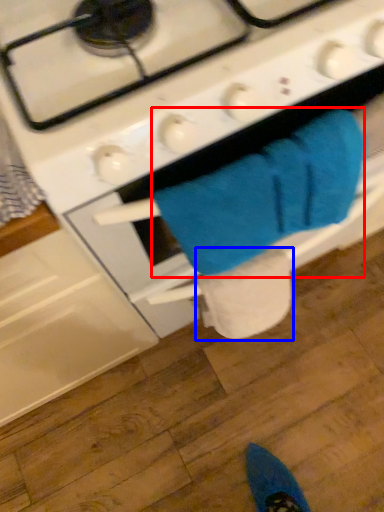
Question: Which object is closer to the camera taking this photo, bath towel (highlighted by a red box) or toilet paper (highlighted by a blue box)?

Choices:
 (A) bath towel
 (B) toilet paper

Answer: (A)